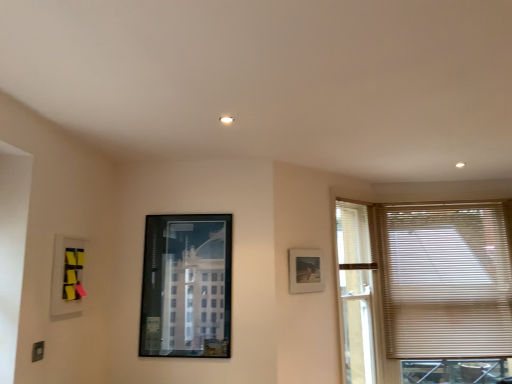
Question: Is matte plastic picture frame at upper left, positioned as the 1th picture frame in front-to-back order, not close to matte black picture frame at upper right, which ranks as the first picture frame in right-to-left order?

Choices:
 (A) yes
 (B) no

Answer: (A)

Question: Is matte plastic picture frame at upper left, the 1th picture frame from the left, at the left side of matte black picture frame at upper right, which is the third picture frame from left to right?

Choices:
 (A) yes
 (B) no

Answer: (A)

Question: Could you tell me if matte plastic picture frame at upper left, positioned as the 1th picture frame in front-to-back order, is turned towards matte black picture frame at upper right, which ranks as the first picture frame in right-to-left order?

Choices:
 (A) no
 (B) yes

Answer: (A)

Question: Is matte plastic picture frame at upper left, which ranks as the third picture frame in right-to-left order, to the right of matte black picture frame at upper right, which is the third picture frame from left to right, from the viewer's perspective?

Choices:
 (A) no
 (B) yes

Answer: (A)

Question: From the image's perspective, is matte plastic picture frame at upper left, positioned as the 1th picture frame in front-to-back order, located beneath matte black picture frame at upper right, the first picture frame from the back?

Choices:
 (A) yes
 (B) no

Answer: (B)

Question: Would you say matte plastic picture frame at upper left, which ranks as the third picture frame in right-to-left order, is inside or outside metallic glass picture frame at center, which is counted as the second picture frame, starting from the right?

Choices:
 (A) outside
 (B) inside

Answer: (A)

Question: Looking at their shapes, would you say matte plastic picture frame at upper left, which ranks as the third picture frame in right-to-left order, is wider or thinner than metallic glass picture frame at center, which is counted as the second picture frame, starting from the right?

Choices:
 (A) wide
 (B) thin

Answer: (A)

Question: In terms of size, does matte plastic picture frame at upper left, the 1th picture frame from the left, appear bigger or smaller than metallic glass picture frame at center, the second picture frame viewed from the front?

Choices:
 (A) big
 (B) small

Answer: (B)

Question: From their relative heights in the image, would you say matte plastic picture frame at upper left, positioned as the 1th picture frame in front-to-back order, is taller or shorter than metallic glass picture frame at center, acting as the 2th picture frame starting from the back?

Choices:
 (A) tall
 (B) short

Answer: (B)

Question: Is point click(x=196, y=354) positioned closer to the camera than point click(x=453, y=340)?

Choices:
 (A) farther
 (B) closer

Answer: (B)

Question: Is metallic glass picture frame at center, the second picture frame viewed from the front, taller or shorter than beige blinds at right?

Choices:
 (A) tall
 (B) short

Answer: (B)

Question: From a real-world perspective, is metallic glass picture frame at center, acting as the 2th picture frame starting from the back, positioned above or below beige blinds at right?

Choices:
 (A) below
 (B) above

Answer: (B)

Question: Would you say metallic glass picture frame at center, the second picture frame viewed from the front, is inside or outside beige blinds at right?

Choices:
 (A) inside
 (B) outside

Answer: (B)

Question: Is matte plastic picture frame at upper left, positioned as the 1th picture frame in front-to-back order, inside or outside of matte black picture frame at upper right, the first picture frame from the back?

Choices:
 (A) outside
 (B) inside

Answer: (A)

Question: From a real-world perspective, is matte plastic picture frame at upper left, positioned as the 1th picture frame in front-to-back order, physically located above or below matte black picture frame at upper right, which is the third picture frame from left to right?

Choices:
 (A) below
 (B) above

Answer: (A)